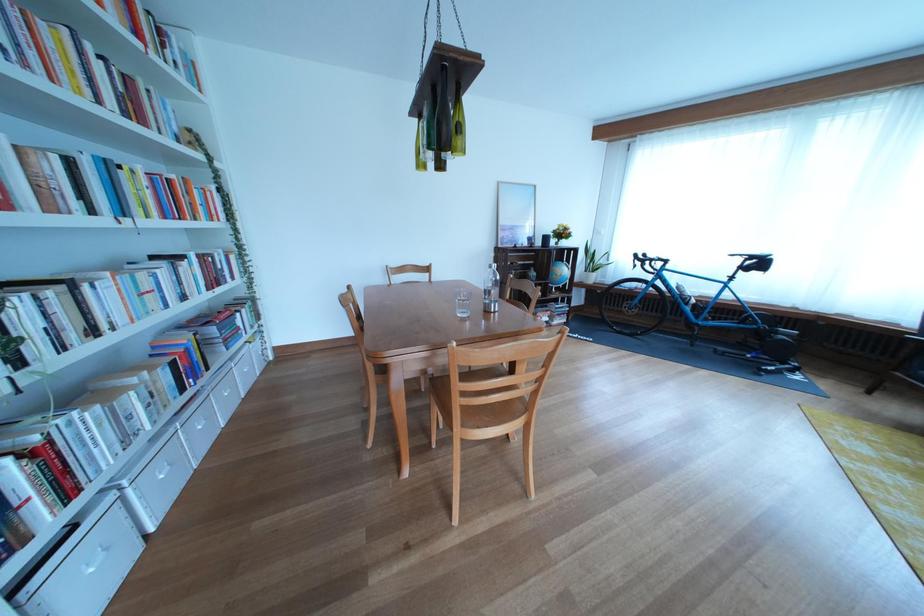
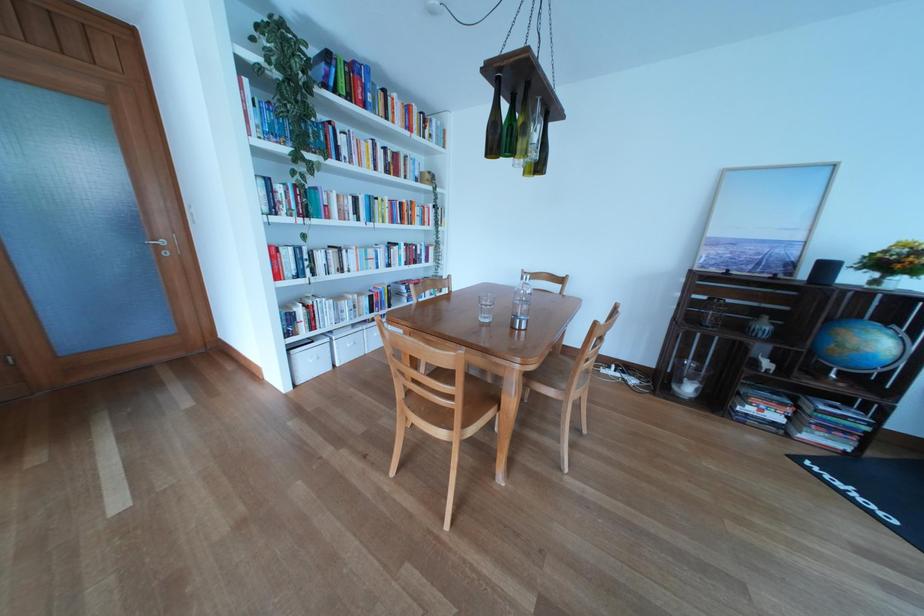
Locate, in the second image, the point that corresponds to pixel 125 503 in the first image.

(341, 345)